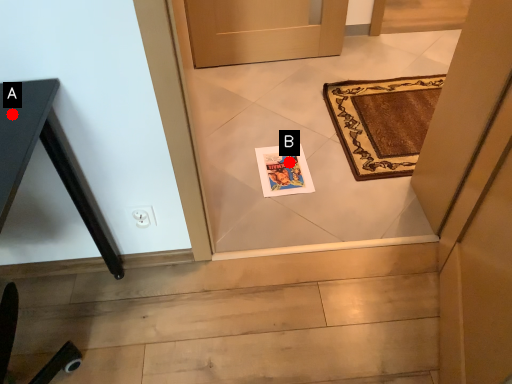
Question: Two points are circled on the image, labeled by A and B beside each circle. Which point is farther from the camera taking this photo?

Choices:
 (A) A is further
 (B) B is further

Answer: (B)